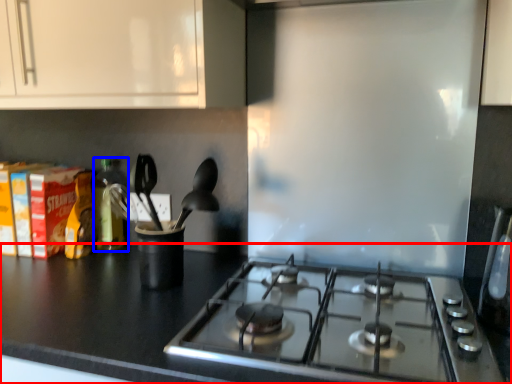
Question: Which of the following is the farthest to the observer, countertop (highlighted by a red box) or bottle (highlighted by a blue box)?

Choices:
 (A) countertop
 (B) bottle

Answer: (B)